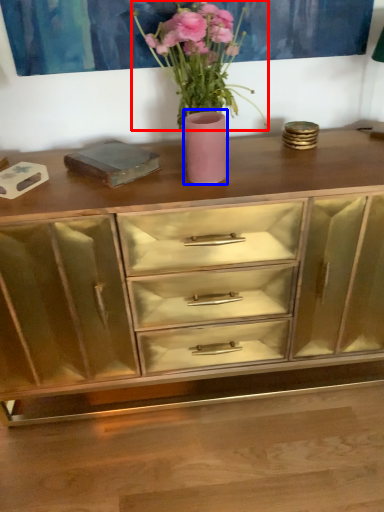
Question: Which object appears farthest to the camera in this image, floral arrangement (highlighted by a red box) or vase (highlighted by a blue box)?

Choices:
 (A) floral arrangement
 (B) vase

Answer: (B)